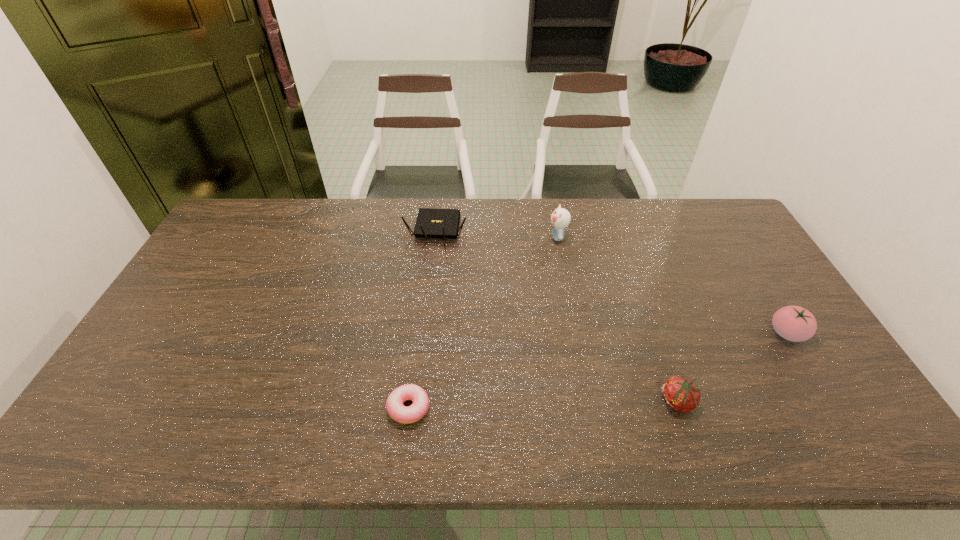
The height and width of the screenshot is (540, 960). What are the coordinates of `vacant region located on the front-facing side of the third object from right to left` in the screenshot? It's located at (437, 237).

Where is `vacant region located 0.170m on the front of the router`? vacant region located 0.170m on the front of the router is located at coordinates (430, 285).

Identify the location of vacant region located 0.220m on the front of the farther tomato. This screenshot has width=960, height=540. (844, 426).

Where is `free space located 0.130m on the right of the shorter tomato`? free space located 0.130m on the right of the shorter tomato is located at coordinates (749, 402).

Find the location of a particular element. The height and width of the screenshot is (540, 960). vacant area situated 0.090m on the left of the doughnut is located at coordinates (349, 407).

You are a GUI agent. You are given a task and a screenshot of the screen. Output one action in this format:
    pyautogui.click(x=<x>, y=<y>)
    Task: Click on the kitten positioned at the far edge
    
    Given the screenshot: What is the action you would take?
    560,218

At what (x,y) coordinates should I click in order to perform the action: click on router positioned at the far edge. Please return your answer as a coordinate pair (x, y). Image resolution: width=960 pixels, height=540 pixels. Looking at the image, I should click on (431, 223).

Identify the location of tomato that is at the near edge. (680, 394).

Find the location of a particular element. The height and width of the screenshot is (540, 960). doughnut present at the near edge is located at coordinates (397, 411).

The height and width of the screenshot is (540, 960). I want to click on object positioned at the right edge, so click(793, 323).